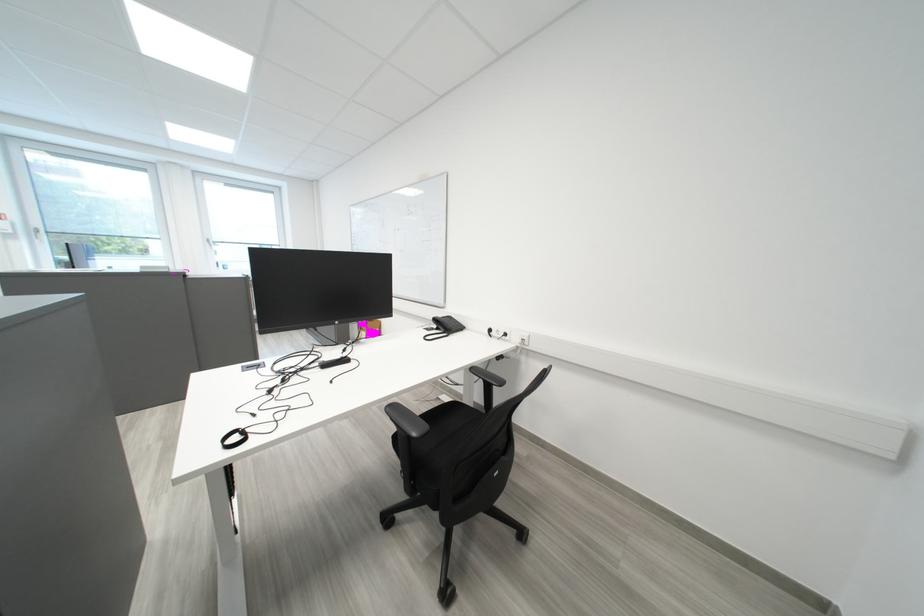
Identify the location of white window handle. The width and height of the screenshot is (924, 616). (210, 249).